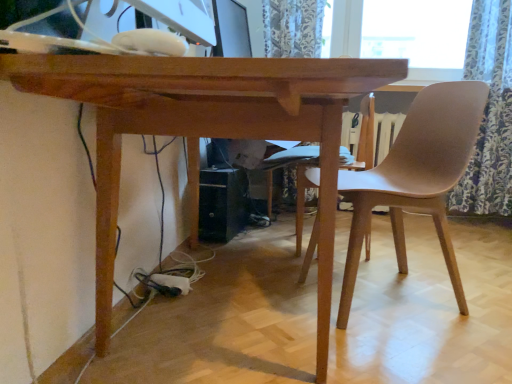
The image size is (512, 384). I want to click on free spot to the left of matte brown chair at right, so click(x=254, y=292).